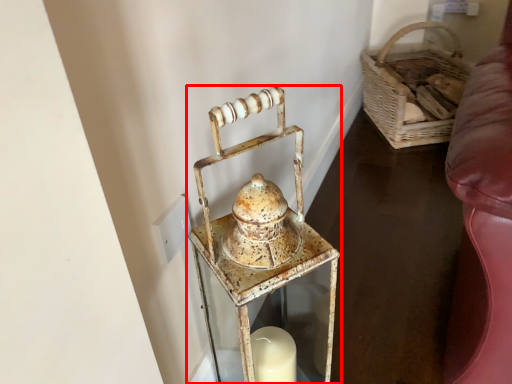
Question: From the image's perspective, where is lantern (annotated by the red box) located relative to basket?

Choices:
 (A) above
 (B) below

Answer: (B)